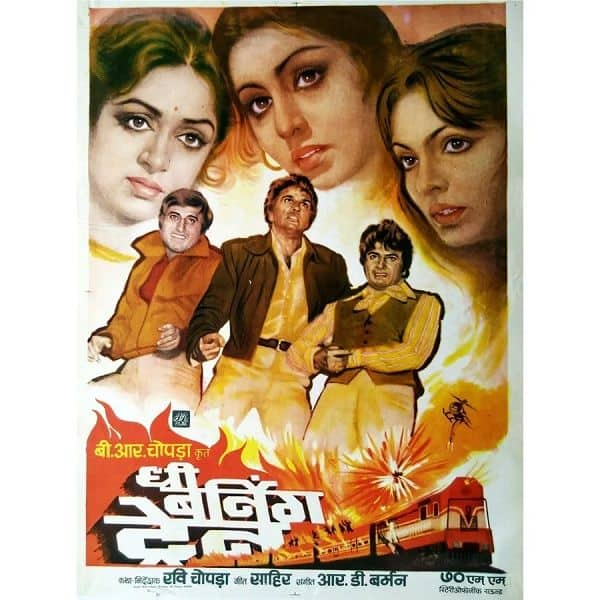
Where is `movie poster`? The image size is (600, 600). movie poster is located at coordinates (301, 288).